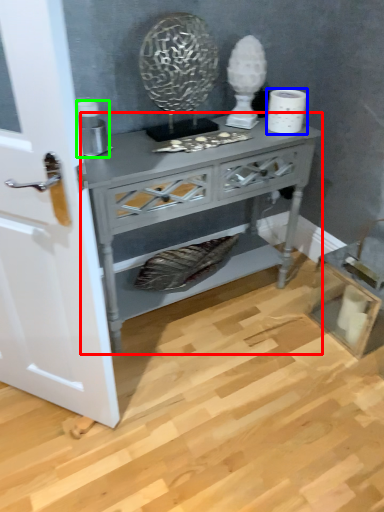
Question: Estimate the real-world distances between objects in this image. Which object is closer to nightstand (highlighted by a red box), toilet paper (highlighted by a blue box) or appliance (highlighted by a green box)?

Choices:
 (A) toilet paper
 (B) appliance

Answer: (B)